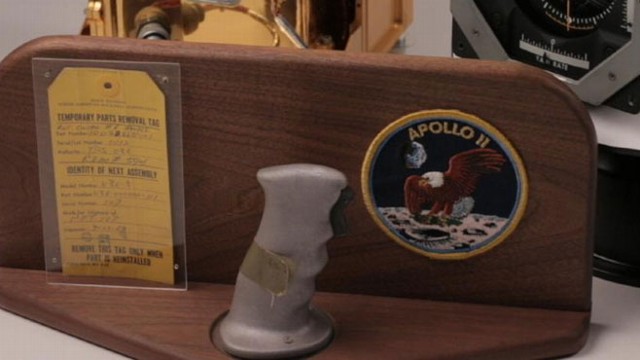
Find the location of `reflective brass object`. reflective brass object is located at coordinates (233, 19).